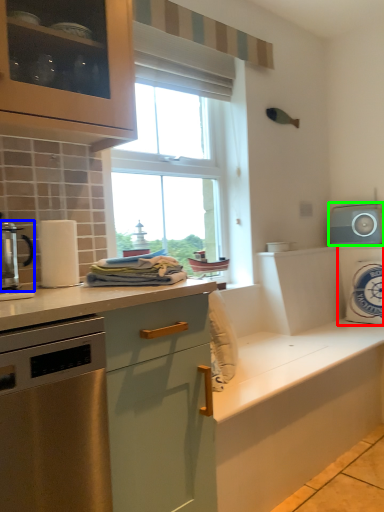
Question: Which is nearer to the appliance (highlighted by a red box)? kitchen appliance (highlighted by a blue box) or appliance (highlighted by a green box).

Choices:
 (A) kitchen appliance
 (B) appliance

Answer: (B)